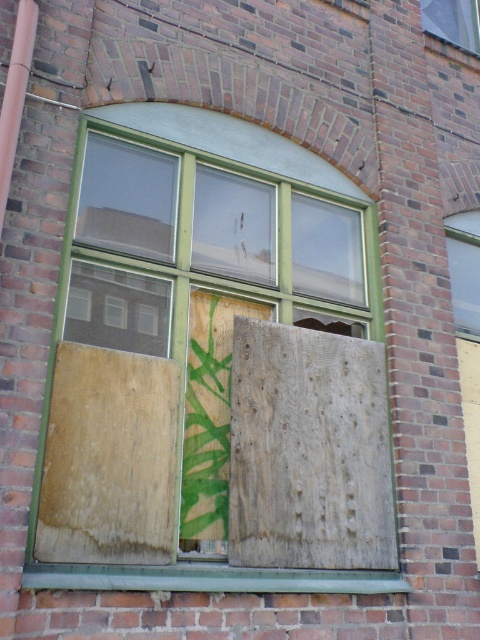
Question: Which point appears farthest from the camera in this image?

Choices:
 (A) (81, 401)
 (B) (455, 19)

Answer: (B)

Question: From the image, what is the correct spatial relationship of green painted wood at center in relation to green painted wood at bottom?

Choices:
 (A) above
 (B) below

Answer: (A)

Question: Is wooden board at right smaller than clear glass window at upper center?

Choices:
 (A) yes
 (B) no

Answer: (A)

Question: Does green painted wood at center appear under clear glass window at upper center?

Choices:
 (A) no
 (B) yes

Answer: (B)

Question: Which is nearer to the clear glass window at upper center?

Choices:
 (A) green painted wood at bottom
 (B) wooden board at right
 (C) green painted wood at center

Answer: (B)

Question: Which of the following is the closest to the observer?

Choices:
 (A) (457, 225)
 (B) (43, 577)

Answer: (B)